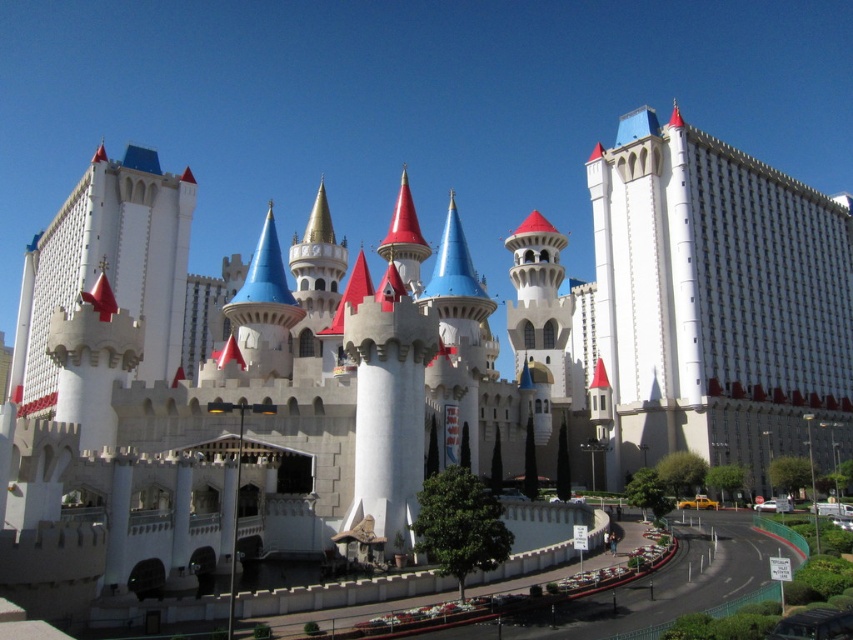
You are standing at the entrance of the modern hotel section and want to take a photo of the point at coordinate point (637, 436). The camera you are using has a maximum focus range of 300 feet. Will the camera be able to focus on the point?

The distance of point (637, 436) from the camera is 313.36 feet, which exceeds the camera maximum focus range of 300 feet. Therefore, the camera will not be able to focus on the point.

You are a tourist planning to take a photo of both the white smooth building at right and the white stone castle at left. Since you want to include both in the frame, which one should you focus on to ensure both are visible?

You should focus on the white stone castle at left because it is larger than the white smooth building at right, making it easier to frame both in the photo.

You are standing at the center of the image and want to move towards the white smooth building at right. In which direction should you walk?

The white smooth building at right is located at point (x=717, y=300), so you should walk towards the right and slightly downward from the center to reach it.